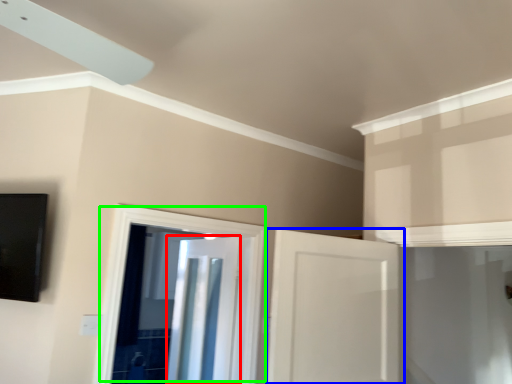
Question: Estimate the real-world distances between objects in this image. Which object is farther from door (highlighted by a red box), door (highlighted by a blue box) or door (highlighted by a green box)?

Choices:
 (A) door
 (B) door

Answer: (A)